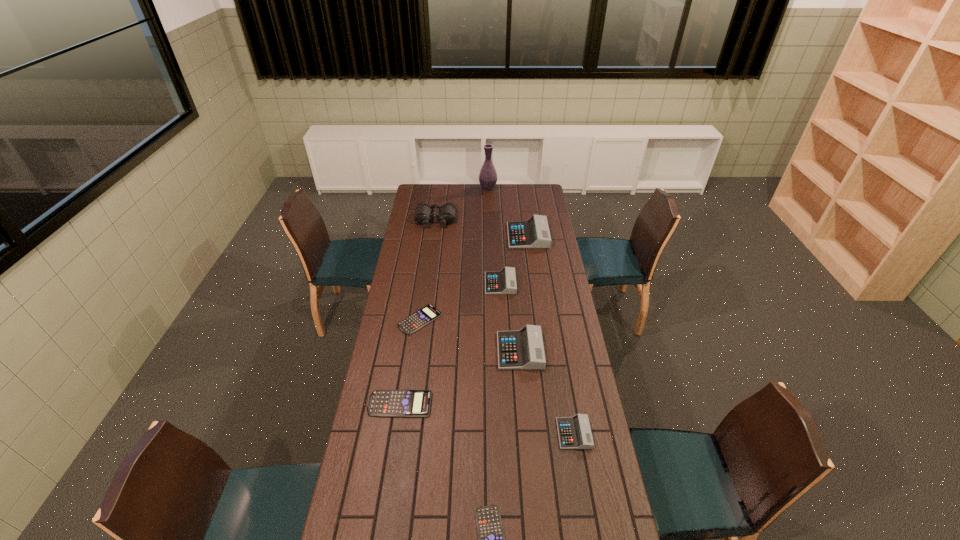
I want to click on the farthest object, so click(x=488, y=176).

Identify the location of the tallest object. This screenshot has width=960, height=540. (488, 176).

I want to click on binoculars, so click(423, 213).

Locate an element on the screen. The image size is (960, 540). the farthest calculator is located at coordinates (534, 233).

Locate an element on the screen. The image size is (960, 540). the farthest gray calculator is located at coordinates [x=534, y=233].

Locate an element on the screen. the third farthest gray calculator is located at coordinates (523, 349).

Image resolution: width=960 pixels, height=540 pixels. I want to click on the third smallest gray calculator, so click(523, 349).

Locate an element on the screen. the fifth shortest calculator is located at coordinates [503, 282].

Find the location of a particular element. This screenshot has height=540, width=960. the fifth shortest object is located at coordinates (503, 282).

The height and width of the screenshot is (540, 960). I want to click on the eighth farthest object, so click(x=574, y=432).